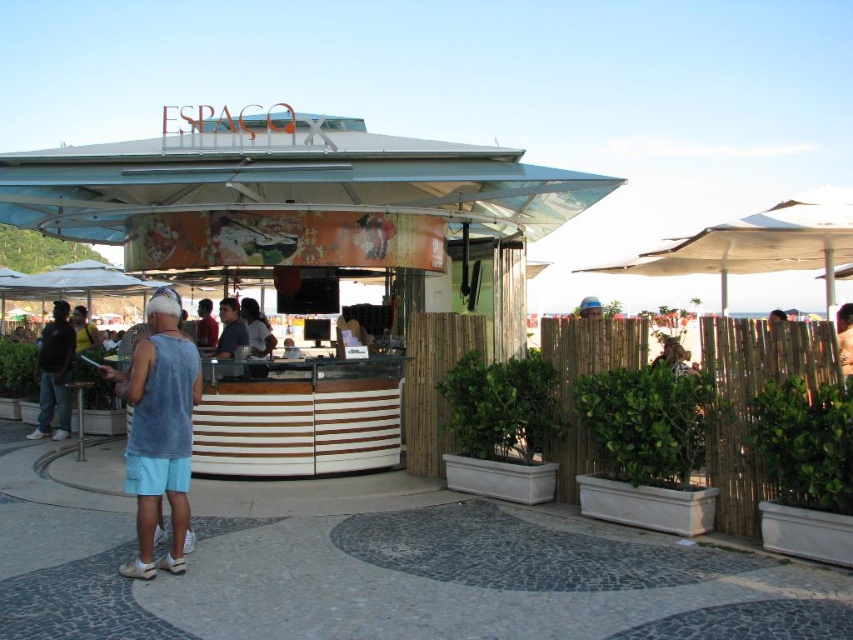
Question: Which object is closer to the camera taking this photo?

Choices:
 (A) blue cotton tank top at center
 (B) dark gray tank top at left

Answer: (A)

Question: Which point is closer to the camera?

Choices:
 (A) blue cotton tank top at center
 (B) dark gray tank top at left

Answer: (A)

Question: Which of the following is the closest to the observer?

Choices:
 (A) blue cotton tank top at center
 (B) dark gray tank top at left

Answer: (A)

Question: Can you confirm if blue cotton tank top at center is positioned to the right of dark gray tank top at left?

Choices:
 (A) yes
 (B) no

Answer: (A)

Question: Is blue cotton tank top at center below dark gray tank top at left?

Choices:
 (A) no
 (B) yes

Answer: (A)

Question: Does blue cotton tank top at center have a greater width compared to dark gray tank top at left?

Choices:
 (A) no
 (B) yes

Answer: (B)